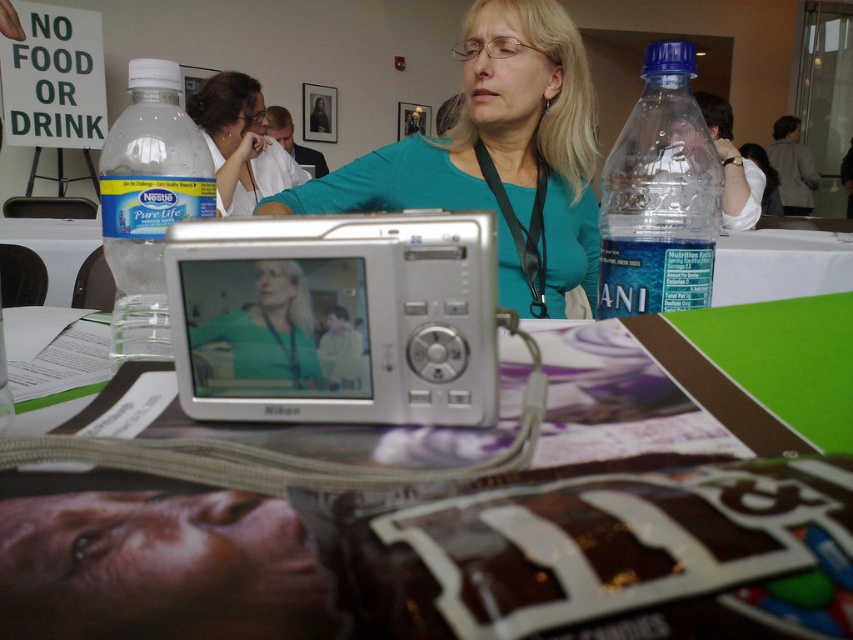
You are standing at the point marked as point (106,253) in the image. You need to place a 50 cm wide box on the table so that it doesn t block the camera s view. Can you fit the box without moving the camera?

The distance between point (106,253) and the viewer is 55.33 centimeters. Since the box is only 50 cm wide, it can fit within the available space without blocking the camera s view.

You are a photographer at the event and need to capture both the teal fabric shirt at center and the matte green shirt at center in a single frame. Which shirt should you focus on to ensure both are in the frame without moving the camera?

The teal fabric shirt at center is taller than the matte green shirt at center, so focusing on the taller teal fabric shirt at center will ensure both shirts are within the camera frame.